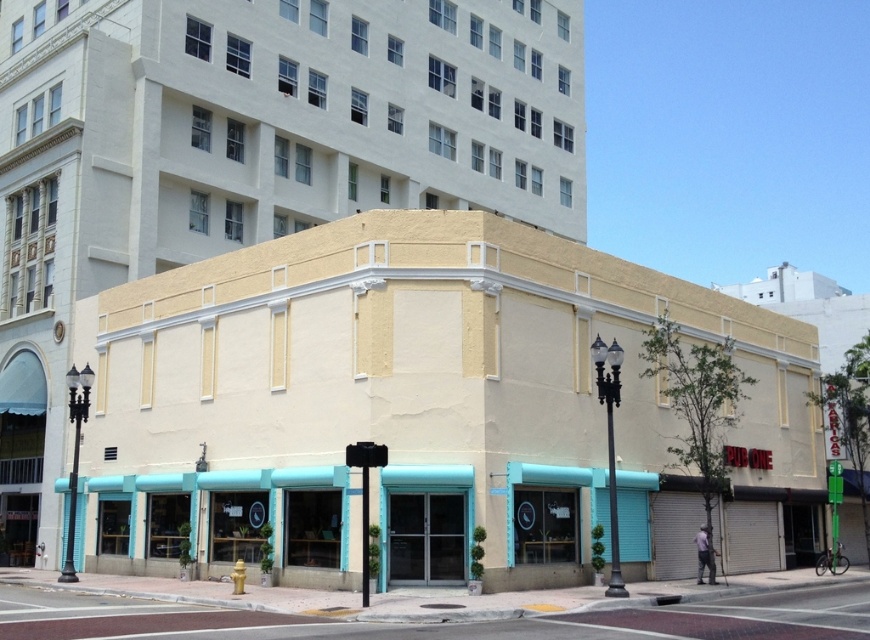
Question: Which of the following is the farthest from the observer?

Choices:
 (A) smooth concrete sidewalk at lower center
 (B) matte yellow building at center

Answer: (B)

Question: Is matte yellow building at center thinner than smooth concrete sidewalk at lower center?

Choices:
 (A) yes
 (B) no

Answer: (B)

Question: Can you confirm if matte yellow building at center is positioned to the left of smooth concrete sidewalk at lower center?

Choices:
 (A) no
 (B) yes

Answer: (A)

Question: Which point is farther to the camera?

Choices:
 (A) (820, 593)
 (B) (174, 273)

Answer: (B)

Question: Is matte yellow building at center above smooth concrete sidewalk at lower center?

Choices:
 (A) yes
 (B) no

Answer: (A)